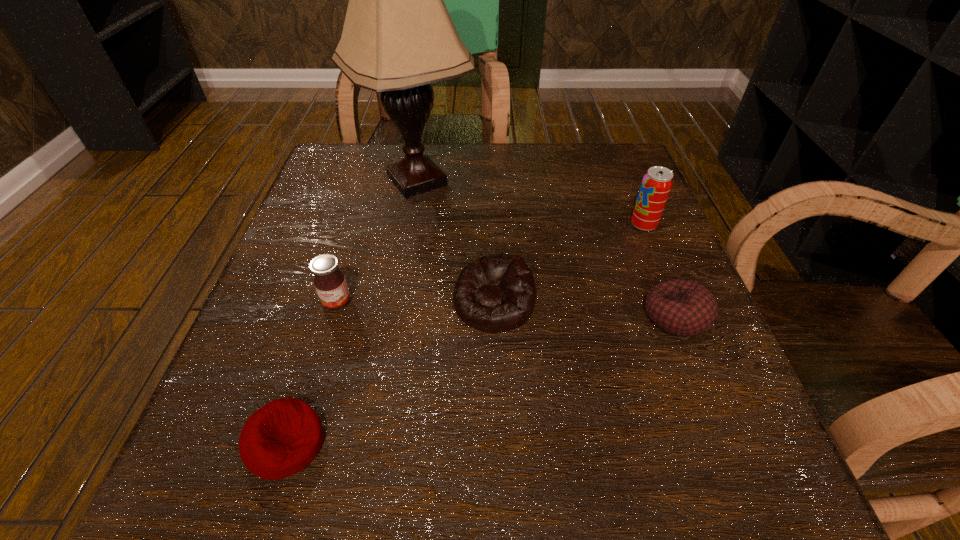
This screenshot has height=540, width=960. Identify the location of vacant space situated on the left of the second beanbag from left to right. (387, 303).

Identify the location of free space located on the left of the rightmost beanbag. (469, 316).

You are a GUI agent. You are given a task and a screenshot of the screen. Output one action in this format:
    pyautogui.click(x=<x>, y=<y>)
    Task: Click on the vacant space located on the seat area of the nearest object
    
    Given the screenshot: What is the action you would take?
    pyautogui.click(x=572, y=443)

This screenshot has height=540, width=960. In order to click on object at the far edge in this screenshot , I will do `click(398, 37)`.

Locate an element on the screen. The width and height of the screenshot is (960, 540). object that is at the near edge is located at coordinates (281, 438).

Locate an element on the screen. This screenshot has height=540, width=960. lamp at the left edge is located at coordinates (398, 37).

The height and width of the screenshot is (540, 960). What are the coordinates of `jam located in the left edge section of the desktop` in the screenshot? It's located at tap(329, 281).

Where is `beanbag situated at the left edge`? The image size is (960, 540). beanbag situated at the left edge is located at coordinates (281, 438).

Where is `soda can that is positioned at the right edge`? The image size is (960, 540). soda can that is positioned at the right edge is located at coordinates (656, 185).

Find the location of a particular element. This screenshot has height=540, width=960. beanbag present at the right edge is located at coordinates (681, 307).